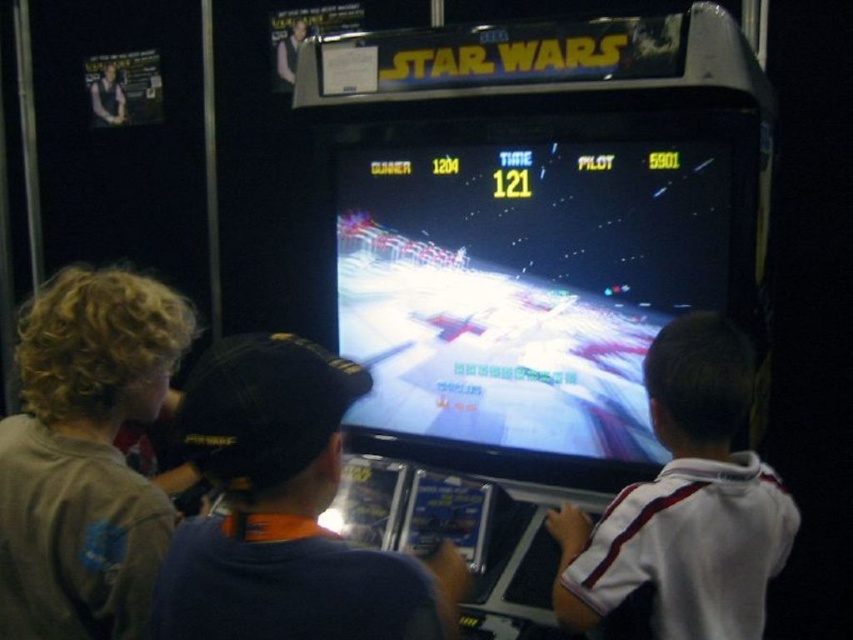
Based on the photo, is dark blue fabric shirt at center smaller than white striped shirt at center?

Actually, dark blue fabric shirt at center might be larger than white striped shirt at center.

Looking at this image, can you confirm if dark blue fabric shirt at center is positioned below white striped shirt at center?

Correct, dark blue fabric shirt at center is located below white striped shirt at center.

Is point (251, 369) behind point (712, 353)?

No.

In order to click on dark blue fabric shirt at center in this screenshot , I will do `click(285, 512)`.

Can you confirm if shiny plastic arcade machine at center is shorter than white striped shirt at center?

No.

Does shiny plastic arcade machine at center appear under white striped shirt at center?

Actually, shiny plastic arcade machine at center is above white striped shirt at center.

Is point (345, 196) positioned behind point (758, 508)?

Yes, it is.

Where is `shiny plastic arcade machine at center`? The height and width of the screenshot is (640, 853). shiny plastic arcade machine at center is located at coordinates (525, 284).

Between dark blue fabric shirt at center and brown cotton shirt at left, which one is positioned lower?

dark blue fabric shirt at center is lower down.

Find the location of a particular element. This screenshot has width=853, height=640. dark blue fabric shirt at center is located at coordinates (285, 512).